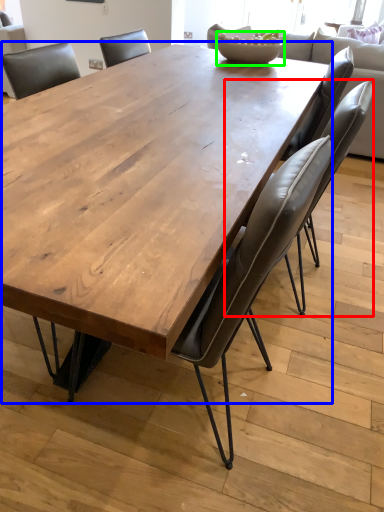
Question: Which object is positioned farthest from chair (highlighted by a red box)? Select from coffee table (highlighted by a blue box) and bowl (highlighted by a green box).

Choices:
 (A) coffee table
 (B) bowl

Answer: (B)